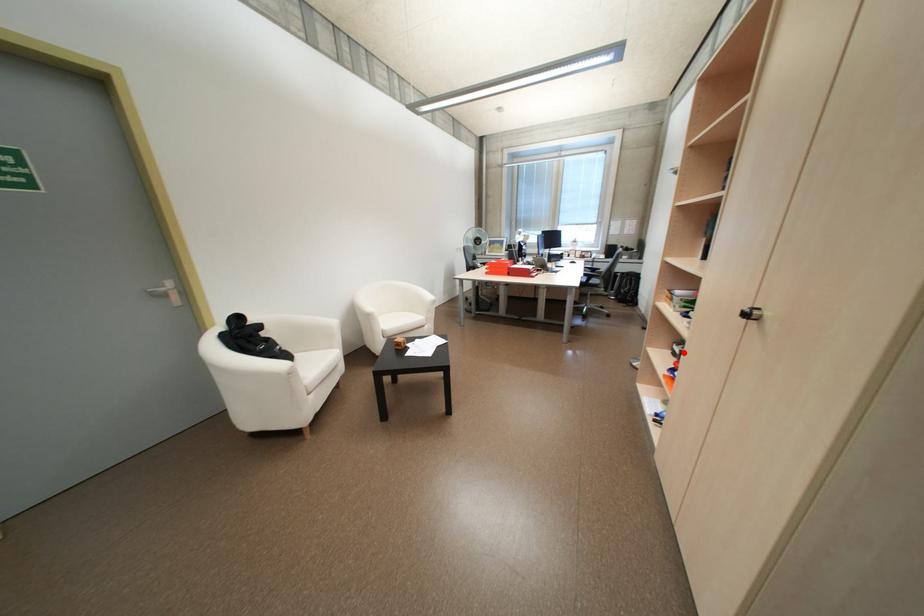
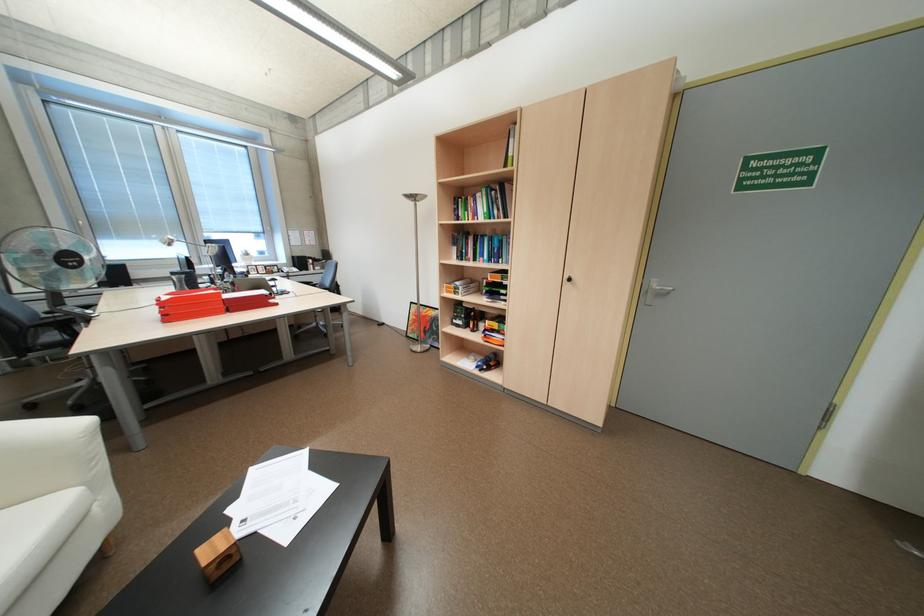
Question: I am providing you with two images of the same scene from different viewpoints. Given a red point in image1, look at the same physical point in image2. Is it:

Choices:
 (A) Closer to the viewpoint
 (B) Farther from the viewpoint

Answer: (B)